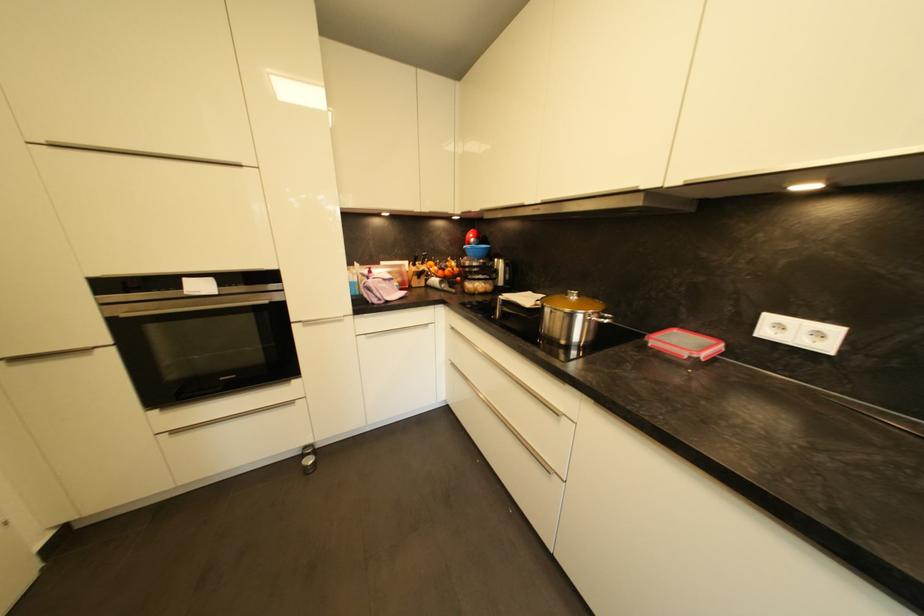
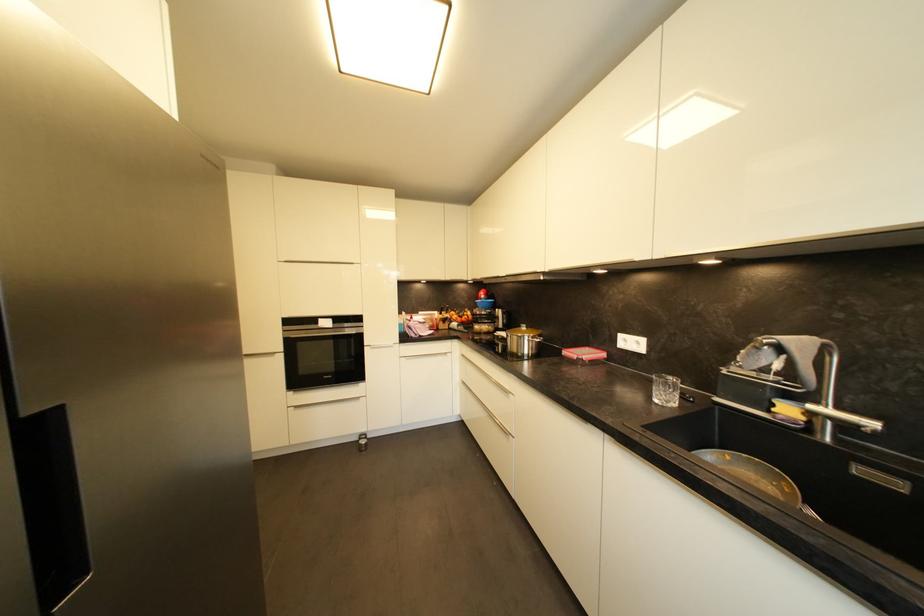
In the second image, find the point that corresponds to pixel 584 298 in the first image.

(531, 330)